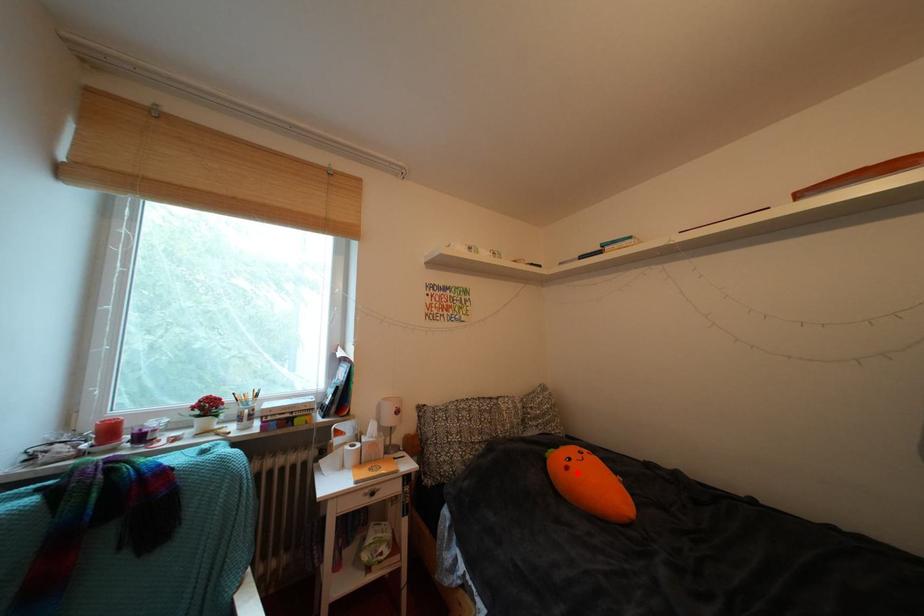
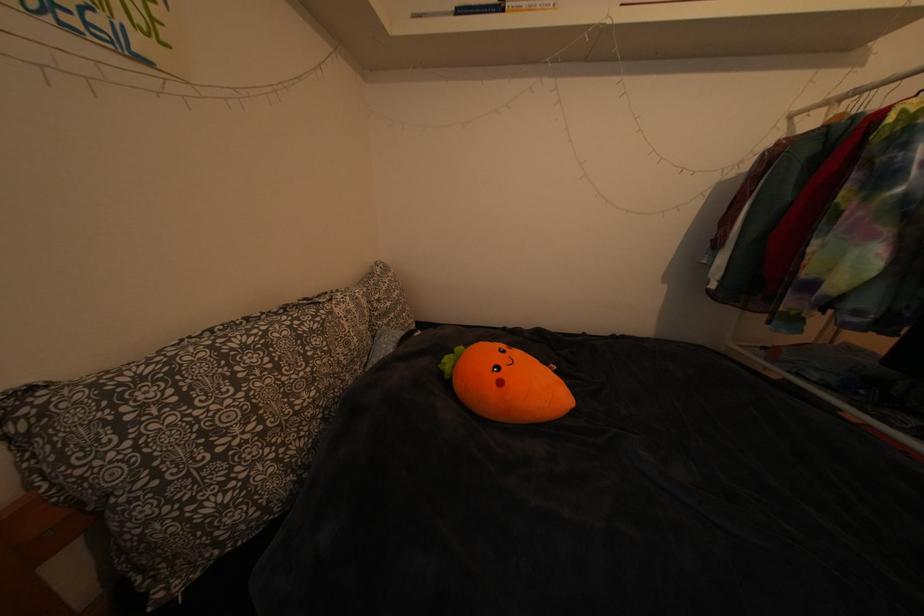
Where in the second image is the point corresponding to the highlighted location from the first image?

(511, 389)